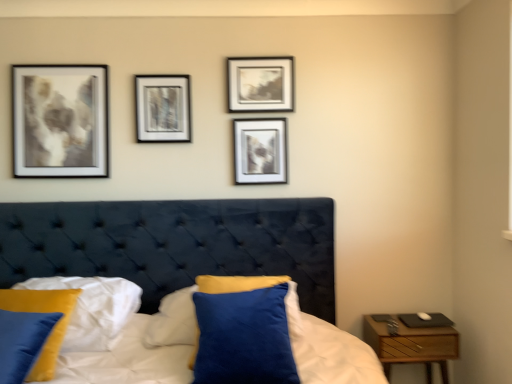
Question: From a real-world perspective, is velvet blue pillow at lower left, which appears as the 2th pillow when viewed from the right, under matte black picture frame at upper center, positioned as the 3th picture frame in left-to-right order?

Choices:
 (A) yes
 (B) no

Answer: (A)

Question: Can matte black picture frame at upper center, which is the 1th picture frame in right-to-left order, be found inside velvet blue pillow at lower left, positioned as the first pillow in left-to-right order?

Choices:
 (A) no
 (B) yes

Answer: (A)

Question: Can you confirm if velvet blue pillow at lower left, which appears as the 2th pillow when viewed from the right, is positioned to the right of matte black picture frame at upper center, which is the 1th picture frame in right-to-left order?

Choices:
 (A) no
 (B) yes

Answer: (A)

Question: Is velvet blue pillow at lower left, which appears as the 2th pillow when viewed from the right, positioned far away from matte black picture frame at upper center, positioned as the 3th picture frame in left-to-right order?

Choices:
 (A) yes
 (B) no

Answer: (A)

Question: From a real-world perspective, is velvet blue pillow at lower left, which appears as the 2th pillow when viewed from the right, positioned over matte black picture frame at upper center, which is the 1th picture frame in right-to-left order, based on gravity?

Choices:
 (A) yes
 (B) no

Answer: (B)

Question: Is velvet blue pillow at lower left, which appears as the 2th pillow when viewed from the right, inside or outside of metallic silver frame at center, the first picture frame when ordered from left to right?

Choices:
 (A) outside
 (B) inside

Answer: (A)

Question: From the image's perspective, is velvet blue pillow at lower left, which appears as the 2th pillow when viewed from the right, above or below metallic silver frame at center, the first picture frame when ordered from left to right?

Choices:
 (A) above
 (B) below

Answer: (B)

Question: Looking at the image, does velvet blue pillow at lower left, which appears as the 2th pillow when viewed from the right, seem bigger or smaller compared to metallic silver frame at center, the 3th picture frame in the right-to-left sequence?

Choices:
 (A) small
 (B) big

Answer: (B)

Question: Considering the positions of velvet blue pillow at lower left, which appears as the 2th pillow when viewed from the right, and metallic silver frame at center, the 3th picture frame in the right-to-left sequence, in the image, is velvet blue pillow at lower left, which appears as the 2th pillow when viewed from the right, wider or thinner than metallic silver frame at center, the 3th picture frame in the right-to-left sequence,?

Choices:
 (A) wide
 (B) thin

Answer: (A)

Question: Considering the relative positions of matte black picture frame at upper center, positioned as the 3th picture frame in left-to-right order, and wooden nightstand at right in the image provided, is matte black picture frame at upper center, positioned as the 3th picture frame in left-to-right order, to the left or to the right of wooden nightstand at right?

Choices:
 (A) right
 (B) left

Answer: (B)

Question: Is matte black picture frame at upper center, which is the 1th picture frame in right-to-left order, in front of or behind wooden nightstand at right in the image?

Choices:
 (A) behind
 (B) front

Answer: (A)

Question: Which is correct: matte black picture frame at upper center, which is the 1th picture frame in right-to-left order, is inside wooden nightstand at right, or outside of it?

Choices:
 (A) outside
 (B) inside

Answer: (A)

Question: From the image's perspective, relative to wooden nightstand at right, is matte black picture frame at upper center, which is the 1th picture frame in right-to-left order, above or below?

Choices:
 (A) below
 (B) above

Answer: (B)

Question: Considering the positions of point (180, 120) and point (245, 107), is point (180, 120) closer or farther from the camera than point (245, 107)?

Choices:
 (A) farther
 (B) closer

Answer: (A)

Question: Considering the relative positions of metallic silver frame at center, the 3th picture frame in the right-to-left sequence, and matte black picture frame at upper center, positioned as the 3th picture frame in left-to-right order, in the image provided, is metallic silver frame at center, the 3th picture frame in the right-to-left sequence, to the left or to the right of matte black picture frame at upper center, positioned as the 3th picture frame in left-to-right order,?

Choices:
 (A) left
 (B) right

Answer: (A)